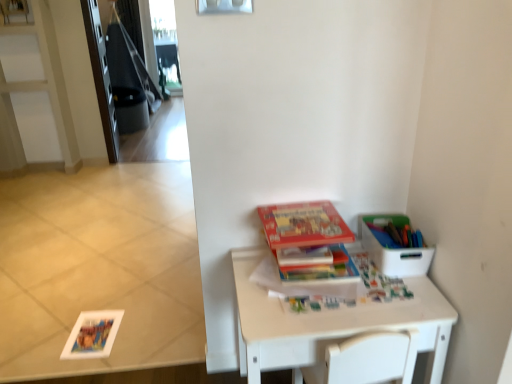
Question: Is matte plastic container at upper right completely or partially outside of white plastic container at right?

Choices:
 (A) yes
 (B) no

Answer: (B)

Question: Does matte plastic container at upper right have a lesser width compared to white plastic container at right?

Choices:
 (A) no
 (B) yes

Answer: (B)

Question: Is matte plastic container at upper right beside white plastic container at right?

Choices:
 (A) yes
 (B) no

Answer: (A)

Question: Is the depth of matte plastic container at upper right greater than that of white plastic container at right?

Choices:
 (A) yes
 (B) no

Answer: (A)

Question: From the image's perspective, is matte plastic container at upper right beneath white plastic container at right?

Choices:
 (A) yes
 (B) no

Answer: (B)

Question: From a real-world perspective, is matte plastic container at upper right over white plastic container at right?

Choices:
 (A) no
 (B) yes

Answer: (B)

Question: Can you confirm if matte plastic container at upper right is thinner than hardcover book at center, the 2th paperback book from the top?

Choices:
 (A) no
 (B) yes

Answer: (B)

Question: Does matte plastic container at upper right appear on the left side of hardcover book at center, which is the 1th paperback book in bottom-to-top order?

Choices:
 (A) no
 (B) yes

Answer: (A)

Question: Would you say matte plastic container at upper right contains hardcover book at center, the 2th paperback book from the top?

Choices:
 (A) yes
 (B) no

Answer: (B)

Question: Considering the relative positions of matte plastic container at upper right and hardcover book at center, which is the 1th paperback book in bottom-to-top order, in the image provided, is matte plastic container at upper right to the right of hardcover book at center, which is the 1th paperback book in bottom-to-top order, from the viewer's perspective?

Choices:
 (A) yes
 (B) no

Answer: (A)

Question: From the image's perspective, is matte plastic container at upper right beneath hardcover book at center, the 2th paperback book from the top?

Choices:
 (A) yes
 (B) no

Answer: (B)

Question: Is the depth of matte plastic container at upper right greater than that of hardcover book at center, the 2th paperback book from the top?

Choices:
 (A) yes
 (B) no

Answer: (A)

Question: Considering the relative positions of white plastic container at right and white matte table at lower right in the image provided, is white plastic container at right to the left of white matte table at lower right from the viewer's perspective?

Choices:
 (A) yes
 (B) no

Answer: (B)